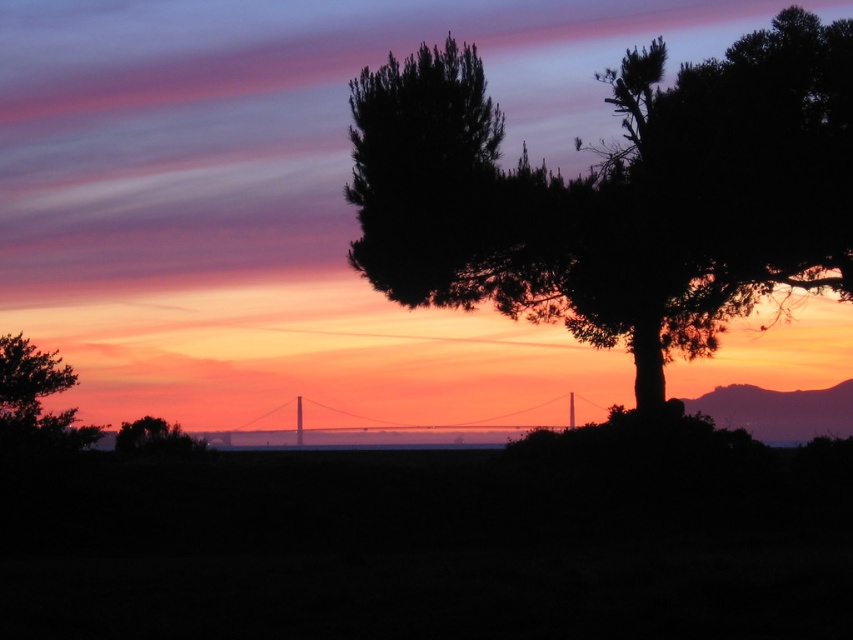
Does metallic bridge at center have a greater width compared to green matte tree at lower left?

Yes.

The image size is (853, 640). What do you see at coordinates (399, 432) in the screenshot? I see `metallic bridge at center` at bounding box center [399, 432].

The width and height of the screenshot is (853, 640). In order to click on metallic bridge at center in this screenshot , I will do `click(399, 432)`.

Does point (773, 125) come behind point (125, 429)?

Yes, it is.

Does black silhouetted tree at upper right appear on the right side of green matte tree at lower left?

Yes, black silhouetted tree at upper right is to the right of green matte tree at lower left.

Between point (790, 236) and point (189, 438), which one is positioned behind?

Point (790, 236)

You are a GUI agent. You are given a task and a screenshot of the screen. Output one action in this format:
    pyautogui.click(x=<x>, y=<y>)
    Task: Click on the black silhouetted tree at upper right
    This screenshot has height=640, width=853.
    Given the screenshot: What is the action you would take?
    pyautogui.click(x=616, y=193)

Based on the photo, is black silhouetted tree at upper right smaller than green matte tree at left?

Actually, black silhouetted tree at upper right might be larger than green matte tree at left.

Is black silhouetted tree at upper right below green matte tree at left?

Incorrect, black silhouetted tree at upper right is not positioned below green matte tree at left.

At what (x,y) coordinates should I click in order to perform the action: click on black silhouetted tree at upper right. Please return your answer as a coordinate pair (x, y). The height and width of the screenshot is (640, 853). Looking at the image, I should click on coord(616,193).